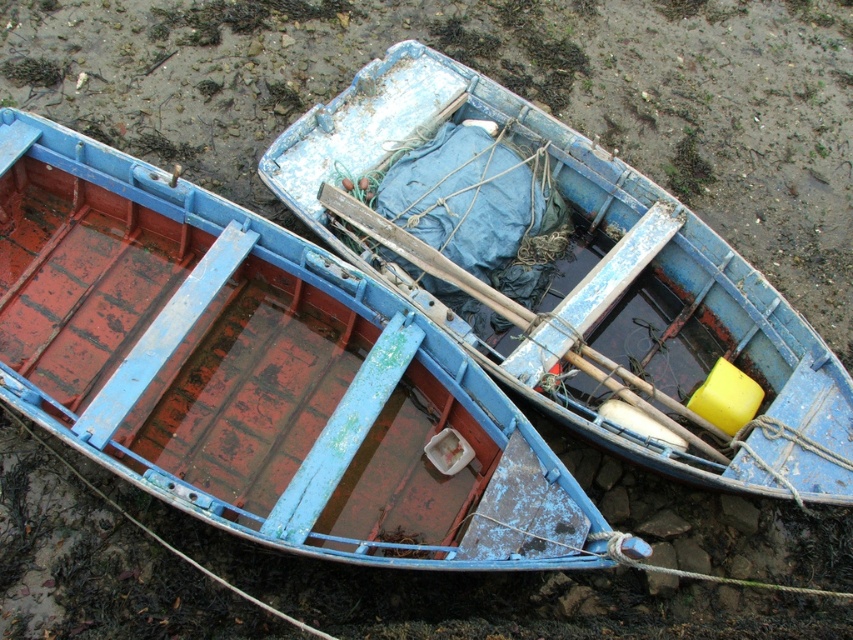
You are a photographer planning to take a wide shot of the scene. You want to include both the rusty metal boat at lower left and the blue painted wood boat at center. Given their sizes, which boat will occupy more space in your photo?

The rusty metal boat at lower left has a larger size compared to the blue painted wood boat at center, so it will occupy more space in the photo.

You are standing at the point with coordinates point (96,349) and want to move towards the point (625,262). Given that the distance between them is 1.2 meters, can you safely walk straight to the destination without obstacles?

Point (96,349) is behind point (625,262), so you can safely walk straight to the destination without obstacles since there are no objects blocking the path between them.